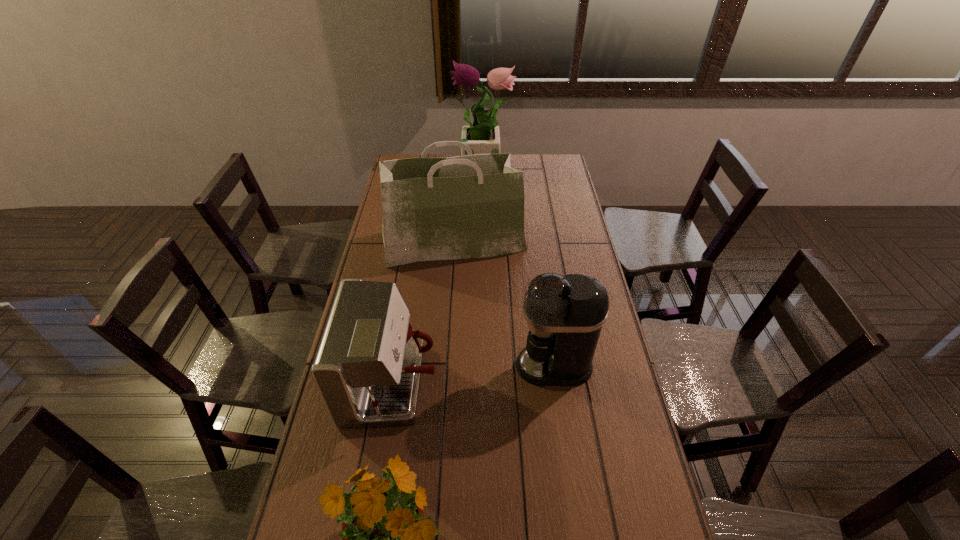
The height and width of the screenshot is (540, 960). What are the coordinates of `vacant point located place cup under the spout of the right coffee maker` in the screenshot? It's located at (477, 366).

This screenshot has height=540, width=960. I want to click on free space located place cup under the spout of the right coffee maker, so click(x=496, y=366).

I want to click on vacant point located 0.210m on the front of the left coffee maker near the spout, so click(509, 384).

The image size is (960, 540). I want to click on object that is positioned at the far edge, so click(x=483, y=137).

Where is `grocery bag that is at the left edge`? Image resolution: width=960 pixels, height=540 pixels. grocery bag that is at the left edge is located at coordinates (472, 206).

Find the location of `coffee maker present at the left edge`. coffee maker present at the left edge is located at coordinates (367, 369).

At what (x,y) coordinates should I click in order to perform the action: click on object situated at the right edge. Please return your answer as a coordinate pair (x, y). Looking at the image, I should click on (565, 315).

In the image, there is a desktop. Identify the location of vacant space at the right edge. Image resolution: width=960 pixels, height=540 pixels. (552, 226).

Identify the location of vacant area that lies between the grocery bag and the shorter coffee maker. This screenshot has height=540, width=960. (422, 313).

Image resolution: width=960 pixels, height=540 pixels. Identify the location of vacant area that lies between the second farthest object and the shorter coffee maker. (422, 313).